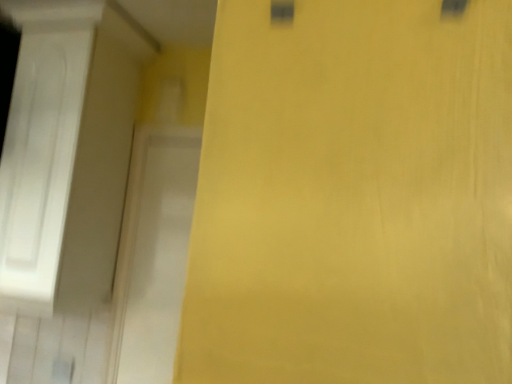
At what (x,y) coordinates should I click in order to perform the action: click on white glossy screen door at left. Please return your answer as a coordinate pair (x, y). The image size is (512, 384). Looking at the image, I should click on (153, 254).

This screenshot has height=384, width=512. Describe the element at coordinates (153, 254) in the screenshot. I see `white glossy screen door at left` at that location.

What is the approximate height of white glossy screen door at left?

35.79 inches.

The image size is (512, 384). What are the coordinates of `white glossy screen door at left` in the screenshot? It's located at (153, 254).